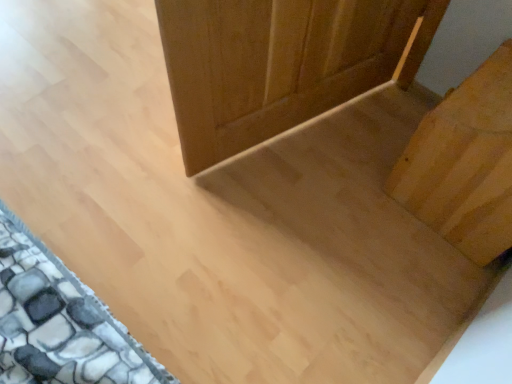
This screenshot has width=512, height=384. I want to click on free point in front of natural wood door at lower right, so click(x=422, y=283).